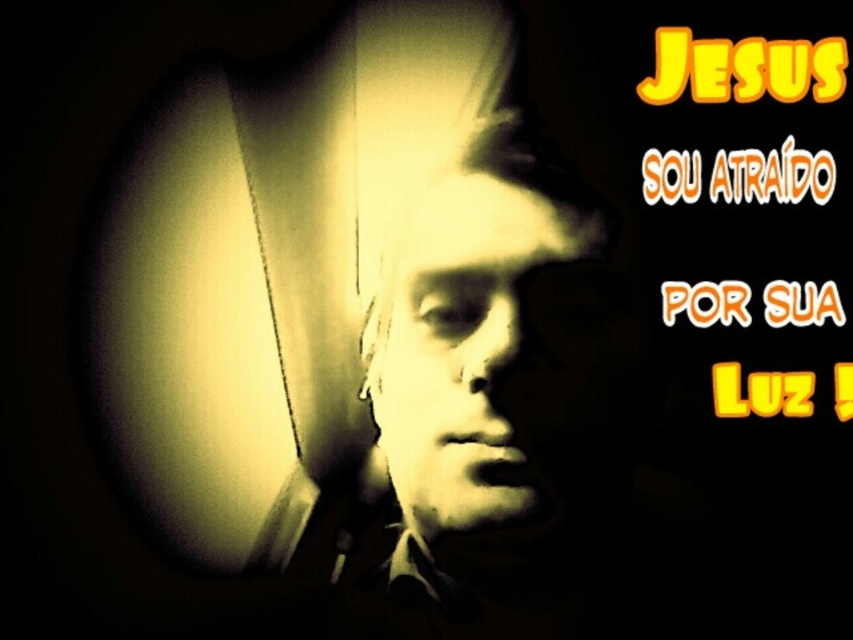
Which is behind, point (749, 150) or point (720, 376)?

Point (720, 376)

Between orangematerial/texturesou atraído at upper center and yellow glowing text at upper right, which one has more height?

Standing taller between the two is orangematerial/texturesou atraído at upper center.

Does point (651, 163) lie behind point (808, 396)?

Yes, it is.

At what (x,y) coordinates should I click in order to perform the action: click on orangematerial/texturesou atraído at upper center. Please return your answer as a coordinate pair (x, y). This screenshot has width=853, height=640. Looking at the image, I should click on (772, 176).

You are a GUI agent. You are given a task and a screenshot of the screen. Output one action in this format:
    pyautogui.click(x=<x>, y=<y>)
    Task: Click on the matte black face at center
    
    Given the screenshot: What is the action you would take?
    pyautogui.click(x=451, y=365)

Identify the location of matte black face at center. The image size is (853, 640). (451, 365).

Between point (407, 298) and point (786, 140), which one is positioned in front?

Positioned in front is point (786, 140).

Does matte yellow face at center have a greater width compared to orangematerial/texturesou atraído at upper center?

Indeed, matte yellow face at center has a greater width compared to orangematerial/texturesou atraído at upper center.

Does point (506, 250) come in front of point (782, 140)?

No, it is behind (782, 140).

Find the location of a particular element. matte yellow face at center is located at coordinates (457, 342).